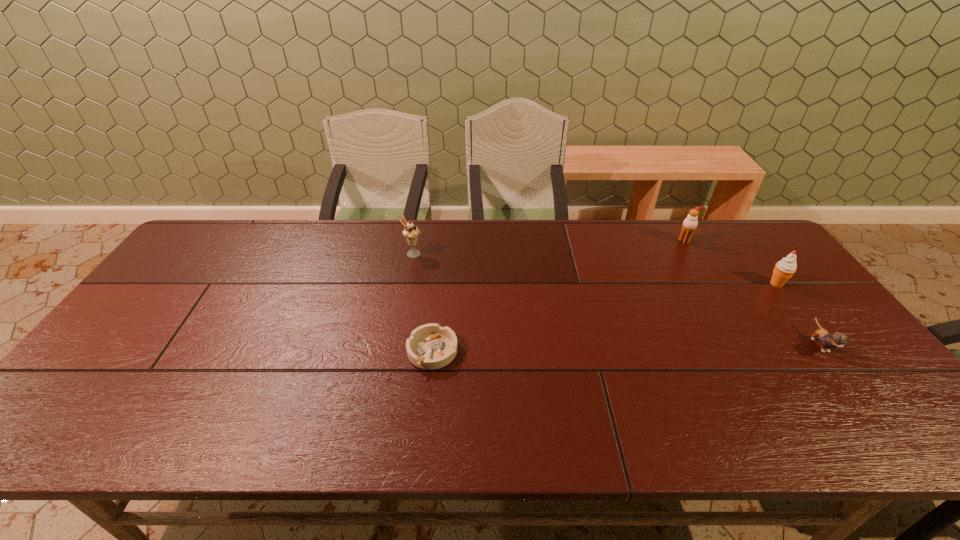
Where is `the second farthest icecream`? The image size is (960, 540). the second farthest icecream is located at coordinates (411, 232).

Locate an element on the screen. the fourth nearest object is located at coordinates (411, 232).

Image resolution: width=960 pixels, height=540 pixels. Find the location of `the third object from left to right`. the third object from left to right is located at coordinates (689, 225).

This screenshot has width=960, height=540. What are the coordinates of `the farthest object` in the screenshot? It's located at (689, 225).

Locate an element on the screen. Image resolution: width=960 pixels, height=540 pixels. the rightmost icecream is located at coordinates (784, 269).

Where is `the nearest icecream`? This screenshot has width=960, height=540. the nearest icecream is located at coordinates (784, 269).

Find the location of a particular element. kitten is located at coordinates (837, 339).

This screenshot has width=960, height=540. What are the coordinates of `the second object from left to right` in the screenshot? It's located at (430, 346).

Locate an element on the screen. Image resolution: width=960 pixels, height=540 pixels. the shortest object is located at coordinates (430, 346).

The width and height of the screenshot is (960, 540). Identify the location of vacant space located 0.340m on the front of the leftmost object. (396, 341).